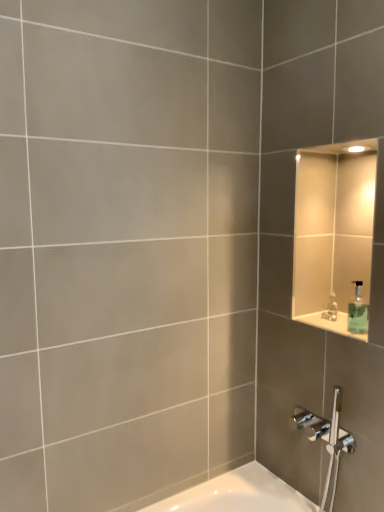
This screenshot has width=384, height=512. What do you see at coordinates (330, 308) in the screenshot?
I see `silver metallic faucet at upper right` at bounding box center [330, 308].

In order to click on silver metallic faucet at upper right in this screenshot , I will do `click(330, 308)`.

Locate an element on the screen. The width and height of the screenshot is (384, 512). green translucent soap dispenser at upper right is located at coordinates (357, 311).

What do you see at coordinates (357, 311) in the screenshot?
I see `green translucent soap dispenser at upper right` at bounding box center [357, 311].

What is the approximate width of green translucent soap dispenser at upper right?

The width of green translucent soap dispenser at upper right is 2.62 inches.

Where is `silver metallic faucet at upper right`? The width and height of the screenshot is (384, 512). silver metallic faucet at upper right is located at coordinates (330, 308).

Considering the relative positions of green translucent soap dispenser at upper right and silver metallic faucet at upper right in the image provided, is green translucent soap dispenser at upper right to the right of silver metallic faucet at upper right from the viewer's perspective?

Yes, green translucent soap dispenser at upper right is to the right of silver metallic faucet at upper right.

Considering their positions, is green translucent soap dispenser at upper right located in front of or behind silver metallic faucet at upper right?

green translucent soap dispenser at upper right is in front of silver metallic faucet at upper right.

Does point (359, 285) come farther from viewer compared to point (327, 316)?

Yes, point (359, 285) is farther from viewer.

From the image's perspective, is green translucent soap dispenser at upper right on silver metallic faucet at upper right?

Indeed, from the image's perspective, green translucent soap dispenser at upper right is shown above silver metallic faucet at upper right.

From a real-world perspective, is green translucent soap dispenser at upper right on silver metallic faucet at upper right?

Correct, in the physical world, green translucent soap dispenser at upper right is higher than silver metallic faucet at upper right.

Which object is wider, green translucent soap dispenser at upper right or silver metallic faucet at upper right?

With larger width is green translucent soap dispenser at upper right.

Which of these two, green translucent soap dispenser at upper right or silver metallic faucet at upper right, stands taller?

Standing taller between the two is green translucent soap dispenser at upper right.

Who is smaller, green translucent soap dispenser at upper right or silver metallic faucet at upper right?

Smaller between the two is silver metallic faucet at upper right.

Could silver metallic faucet at upper right be considered to be inside green translucent soap dispenser at upper right?

Definitely not — silver metallic faucet at upper right is not inside green translucent soap dispenser at upper right.

Are green translucent soap dispenser at upper right and silver metallic faucet at upper right far apart?

green translucent soap dispenser at upper right is actually quite close to silver metallic faucet at upper right.

Is green translucent soap dispenser at upper right facing towards silver metallic faucet at upper right?

No, green translucent soap dispenser at upper right is not turned towards silver metallic faucet at upper right.

How different are the orientations of green translucent soap dispenser at upper right and silver metallic faucet at upper right in degrees?

1.17 degrees.

How distant is green translucent soap dispenser at upper right from silver metallic faucet at upper right?

They are 3.16 inches apart.

The height and width of the screenshot is (512, 384). Identify the location of faucet behind the green translucent soap dispenser at upper right. (330, 308).

Considering the relative positions of silver metallic faucet at upper right and green translucent soap dispenser at upper right in the image provided, is silver metallic faucet at upper right to the left or to the right of green translucent soap dispenser at upper right?

Based on their positions, silver metallic faucet at upper right is located to the left of green translucent soap dispenser at upper right.

Considering the positions of objects silver metallic faucet at upper right and green translucent soap dispenser at upper right in the image provided, who is behind, silver metallic faucet at upper right or green translucent soap dispenser at upper right?

silver metallic faucet at upper right is more distant.

Is point (333, 315) closer or farther from the camera than point (354, 298)?

Point (333, 315) is positioned farther from the camera compared to point (354, 298).

From the image's perspective, which one is positioned lower, silver metallic faucet at upper right or green translucent soap dispenser at upper right?

silver metallic faucet at upper right.

From a real-world perspective, who is located higher, silver metallic faucet at upper right or green translucent soap dispenser at upper right?

green translucent soap dispenser at upper right, from a real-world perspective.

Is silver metallic faucet at upper right wider than green translucent soap dispenser at upper right?

No, silver metallic faucet at upper right is not wider than green translucent soap dispenser at upper right.

Is silver metallic faucet at upper right taller than green translucent soap dispenser at upper right?

In fact, silver metallic faucet at upper right may be shorter than green translucent soap dispenser at upper right.

Who is smaller, silver metallic faucet at upper right or green translucent soap dispenser at upper right?

With smaller size is silver metallic faucet at upper right.

Based on the photo, is silver metallic faucet at upper right inside or outside of green translucent soap dispenser at upper right?

silver metallic faucet at upper right lies outside green translucent soap dispenser at upper right.

Is silver metallic faucet at upper right positioned far away from green translucent soap dispenser at upper right?

silver metallic faucet at upper right is actually quite close to green translucent soap dispenser at upper right.

Is silver metallic faucet at upper right aimed at green translucent soap dispenser at upper right?

No, silver metallic faucet at upper right does not turn towards green translucent soap dispenser at upper right.

How many degrees apart are the facing directions of silver metallic faucet at upper right and green translucent soap dispenser at upper right?

1.17 degrees separate the facing orientations of silver metallic faucet at upper right and green translucent soap dispenser at upper right.

Could you measure the distance between silver metallic faucet at upper right and green translucent soap dispenser at upper right?

3.16 inches.

Locate an element on the screen. faucet located underneath the green translucent soap dispenser at upper right (from a real-world perspective) is located at coordinates (330, 308).

You are a GUI agent. You are given a task and a screenshot of the screen. Output one action in this format:
    pyautogui.click(x=<x>, y=<y>)
    Task: Click on the faucet beneath the green translucent soap dispenser at upper right (from a real-world perspective)
    Image resolution: width=384 pixels, height=512 pixels.
    Given the screenshot: What is the action you would take?
    pyautogui.click(x=330, y=308)

You are a GUI agent. You are given a task and a screenshot of the screen. Output one action in this format:
    pyautogui.click(x=<x>, y=<y>)
    Task: Click on the faucet below the green translucent soap dispenser at upper right (from the image's perspective)
    
    Given the screenshot: What is the action you would take?
    pyautogui.click(x=330, y=308)